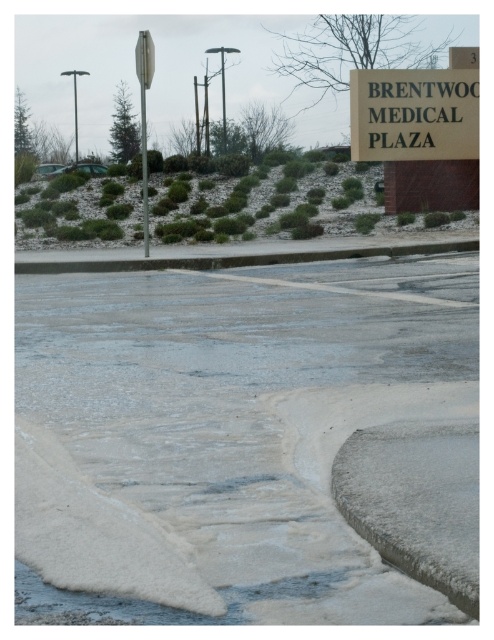
Question: Which of the following is the closest to the observer?

Choices:
 (A) white frosted puddle at lower center
 (B) metallic pole at center

Answer: (A)

Question: Does white plastic sign at upper center appear on the right side of metallic reflective street sign at upper center?

Choices:
 (A) yes
 (B) no

Answer: (A)

Question: Which object is farther from the camera taking this photo?

Choices:
 (A) metallic silver sign at center-left
 (B) white plastic sign at upper center
 (C) metallic reflective street sign at upper center
 (D) white frosted puddle at lower center

Answer: (B)

Question: Which is nearer to the metallic silver sign at center-left?

Choices:
 (A) white frosted puddle at lower center
 (B) metallic pole at center

Answer: (B)

Question: Is white frosted puddle at lower center thinner than metallic reflective street sign at upper center?

Choices:
 (A) no
 (B) yes

Answer: (A)

Question: Considering the relative positions of metallic silver sign at center-left and metallic reflective street sign at upper center in the image provided, where is metallic silver sign at center-left located with respect to metallic reflective street sign at upper center?

Choices:
 (A) above
 (B) below

Answer: (B)